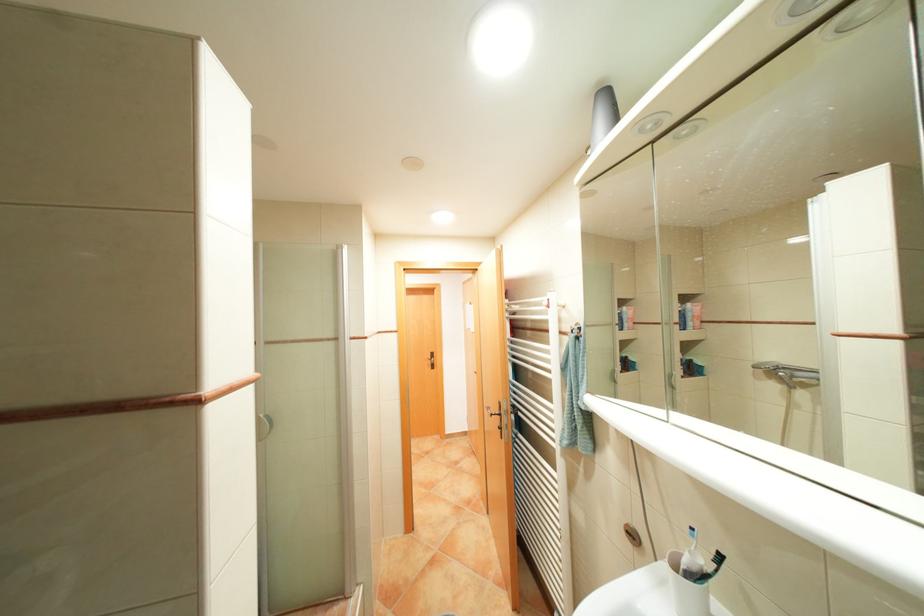
Where is `shower door handle`? shower door handle is located at coordinates (262, 426).